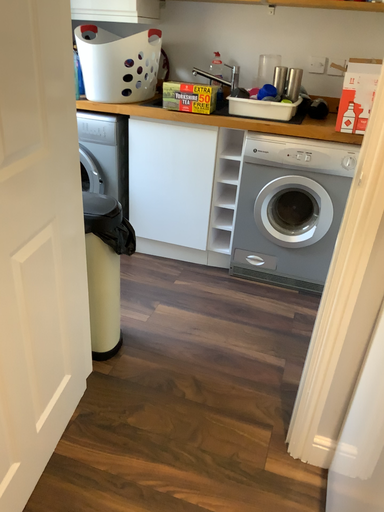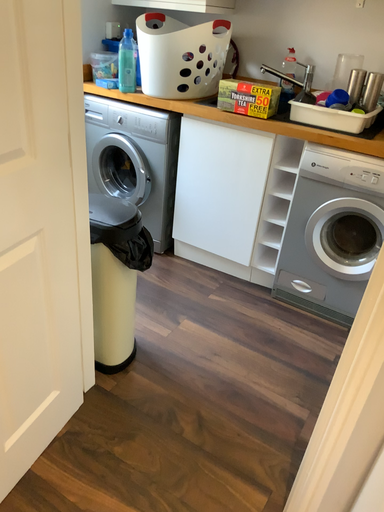
Question: Which way did the camera rotate in the video?

Choices:
 (A) rotated left
 (B) rotated right

Answer: (A)